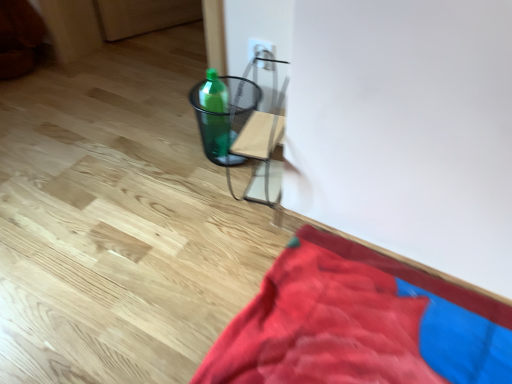
Question: From a real-world perspective, is velvet red blanket at lower right positioned above or below green plastic bottle at center?

Choices:
 (A) below
 (B) above

Answer: (A)

Question: Considering the positions of velvet red blanket at lower right and green plastic bottle at center in the image, is velvet red blanket at lower right bigger or smaller than green plastic bottle at center?

Choices:
 (A) small
 (B) big

Answer: (B)

Question: Based on their relative distances, which object is nearer to the white plastic electric outlet at upper center?

Choices:
 (A) green plastic bottle at center
 (B) velvet red blanket at lower right

Answer: (A)

Question: Which is farther from the white plastic electric outlet at upper center?

Choices:
 (A) velvet red blanket at lower right
 (B) green plastic bottle at center

Answer: (A)